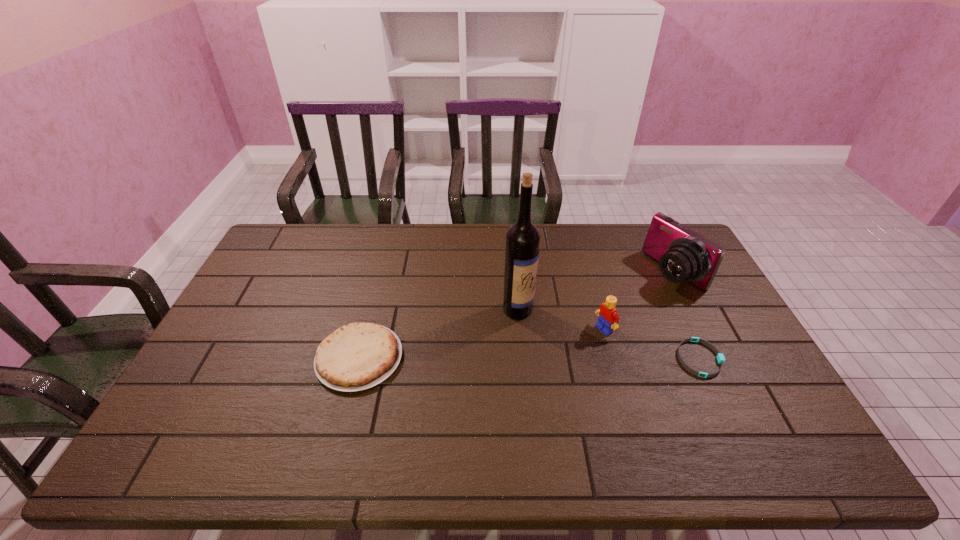
Locate an element on the screen. free space on the desktop that is between the second shortest object and the wristband and is positioned on the face of the third tallest object is located at coordinates pyautogui.click(x=548, y=359).

You are a GUI agent. You are given a task and a screenshot of the screen. Output one action in this format:
    pyautogui.click(x=<x>, y=<y>)
    Task: Click on the free space on the desktop that is between the second shortest object and the wristband and is positioned on the front-facing side of the farthest object
    
    Given the screenshot: What is the action you would take?
    pyautogui.click(x=519, y=358)

Locate an element on the screen. This screenshot has height=540, width=960. free spot on the desktop that is between the second shortest object and the shortest object and is positioned on the label of the second object from left to right is located at coordinates (575, 359).